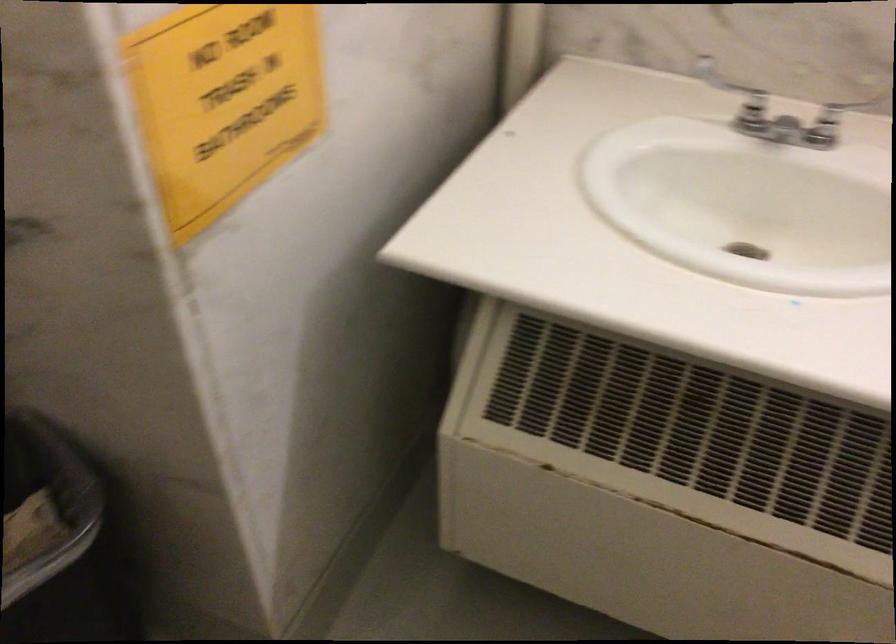
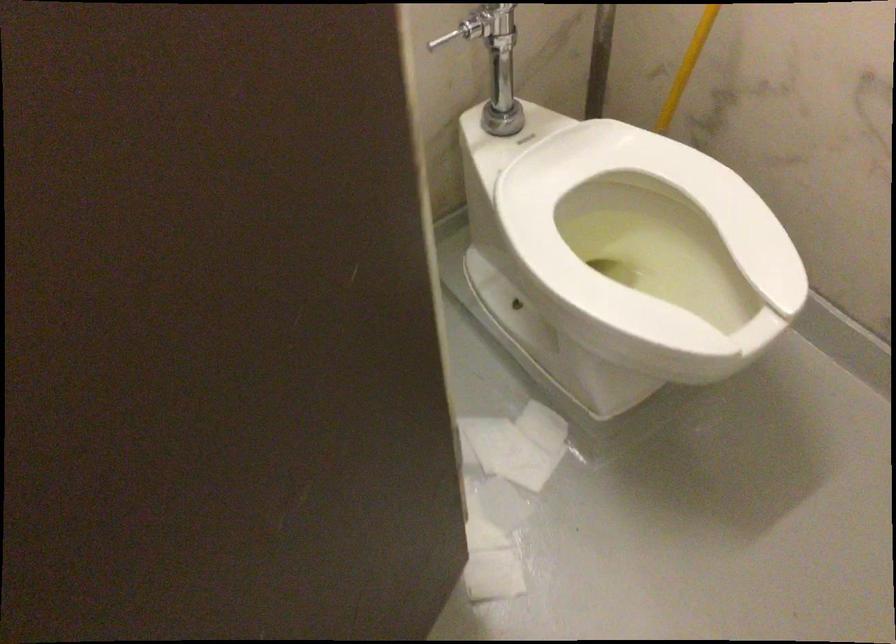
The images are taken continuously from a first-person perspective. In which direction is your viewpoint rotating?

The camera's rotation is toward right-down.